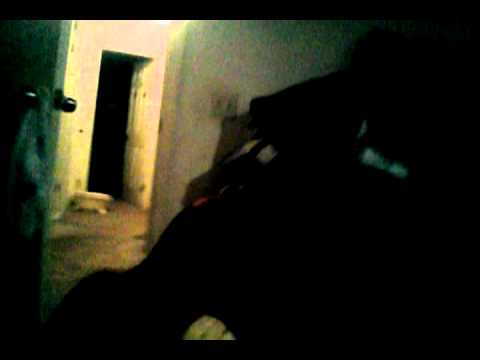
I want to click on light switch, so click(218, 106).